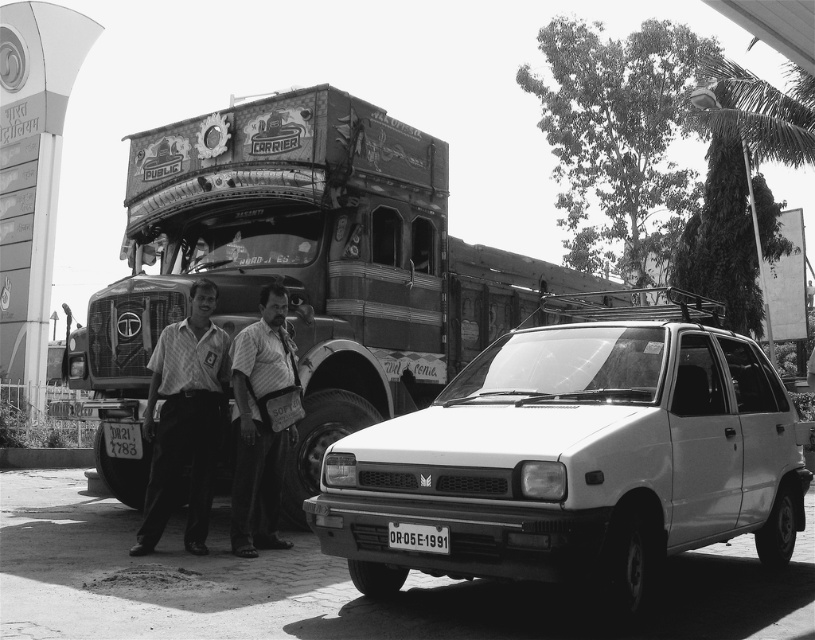
Question: Which object is positioned closest to the decorative painted truck at center?

Choices:
 (A) light brown shirt at center
 (B) black plastic license plate at lower left
 (C) white matte hatchback at center
 (D) striped fabric bag at center

Answer: (D)

Question: Is decorative painted truck at center wider than white plastic license plate at center?

Choices:
 (A) no
 (B) yes

Answer: (B)

Question: Estimate the real-world distances between objects in this image. Which object is farther from the white plastic license plate at center?

Choices:
 (A) white matte hatchback at center
 (B) striped fabric bag at center

Answer: (B)

Question: Observing the image, what is the correct spatial positioning of light brown shirt at center in reference to white plastic license plate at center?

Choices:
 (A) right
 (B) left

Answer: (B)

Question: Which point is closer to the camera taking this photo?

Choices:
 (A) (115, 426)
 (B) (347, 368)
 (C) (208, 348)
 (D) (399, 488)

Answer: (D)

Question: Can you confirm if decorative painted truck at center is positioned below light brown shirt at center?

Choices:
 (A) no
 (B) yes

Answer: (A)